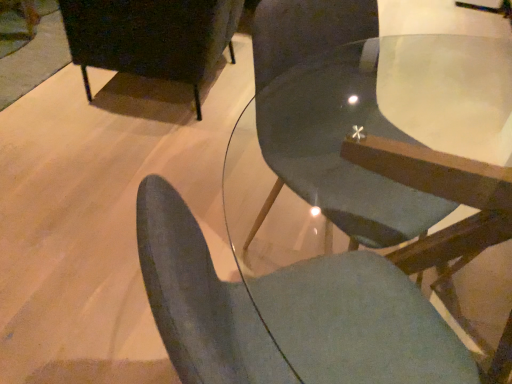
Locate an element on the screen. The image size is (512, 384). free location in front of matte black chair at upper left, the third chair viewed from the front is located at coordinates (121, 163).